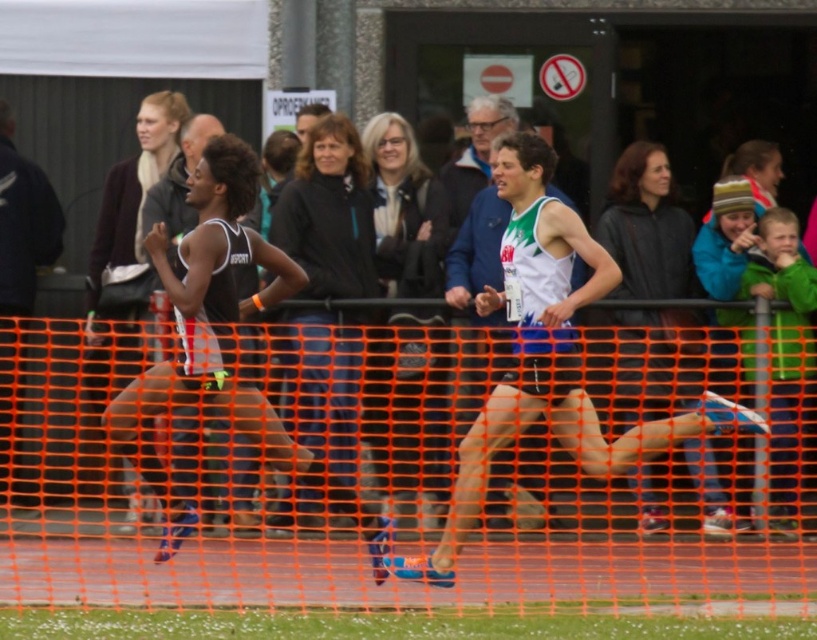
You are a photographer capturing the track and field event. You want to focus on the two points in the image, point 1 at coordinates point (360, 588) and point 2 at coordinates point (472, 369). Which point should you adjust your focus to if you want to capture the athlete closer to the camera?

Point 1 at coordinates point (360, 588) is closer to the camera, so you should focus on point 1 to capture the athlete closer to the camera.

You are a photographer at the track and field event. You need to capture a photo where both the matte black tank top at left and the white jersey at center are visible. Considering their heights, which athlete should you focus on to ensure both are in frame?

The matte black tank top at left has a lesser height compared to white jersey at center. To ensure both are visible in the frame, focus on the taller athlete, the white jersey at center, and adjust the camera angle to include the shorter athlete below them.

Based on the scene description, can you determine which object is positioned lower in the image between the orange mesh fence at center and the white fabric tank top at center?

The orange mesh fence at center is positioned below the white fabric tank top at center, so the orange mesh fence at center is lower in the image.